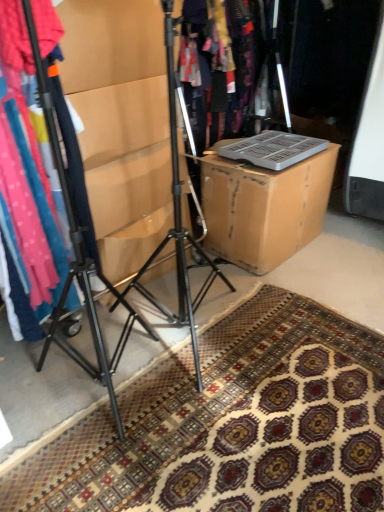
I want to click on free space underneath black metal tripod at center (from a real-world perspective), so click(x=109, y=369).